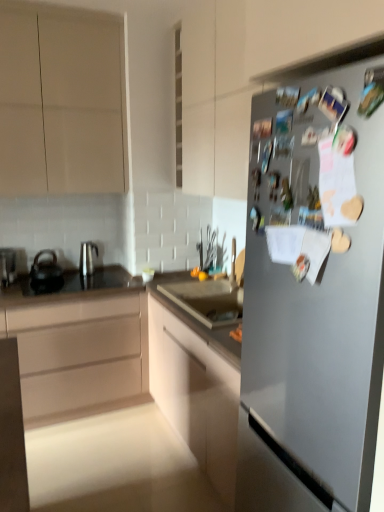
Where is `vacant area that lies in front of satin silver kettle at left, which is counted as the 1th tea pot, starting from the right`? The image size is (384, 512). vacant area that lies in front of satin silver kettle at left, which is counted as the 1th tea pot, starting from the right is located at coordinates (88, 281).